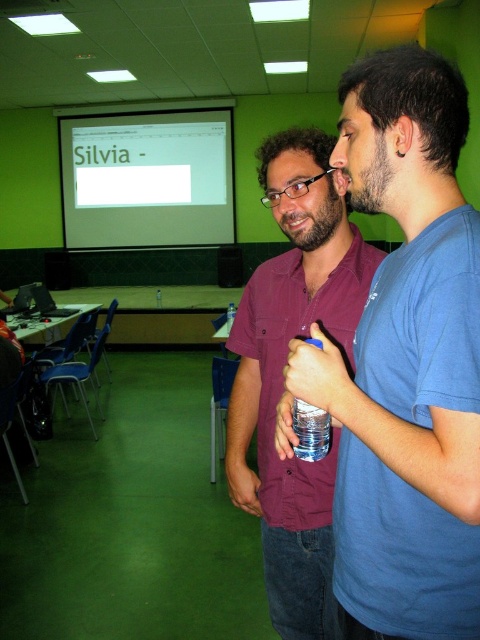
Consider the image. Can you confirm if blue cotton t-shirt at center is wider than clear plastic bottle at center?

Yes.

Between blue cotton t-shirt at center and clear plastic bottle at center, which one is positioned higher?

blue cotton t-shirt at center is above.

Which is in front, point (422, 404) or point (305, 413)?

Point (422, 404)

Image resolution: width=480 pixels, height=640 pixels. Identify the location of blue cotton t-shirt at center. (405, 364).

Is white glossy projection screen at upper center behind clear plastic bottle at center?

Yes.

Does white glossy projection screen at upper center have a lesser width compared to clear plastic bottle at center?

Incorrect, white glossy projection screen at upper center's width is not less than clear plastic bottle at center's.

Identify the location of white glossy projection screen at upper center. The height and width of the screenshot is (640, 480). (147, 177).

Which is behind, point (252, 385) or point (320, 413)?

Positioned behind is point (252, 385).

This screenshot has height=640, width=480. What do you see at coordinates (283, 376) in the screenshot? I see `maroon shirt at center` at bounding box center [283, 376].

Locate an element on the screen. maroon shirt at center is located at coordinates (283, 376).